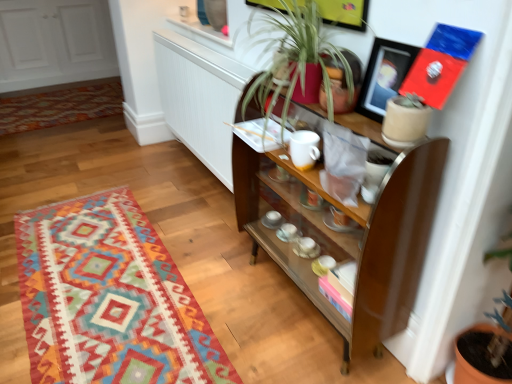
I want to click on free space below brown wooden shelf at center (from a real-world perspective), so click(293, 301).